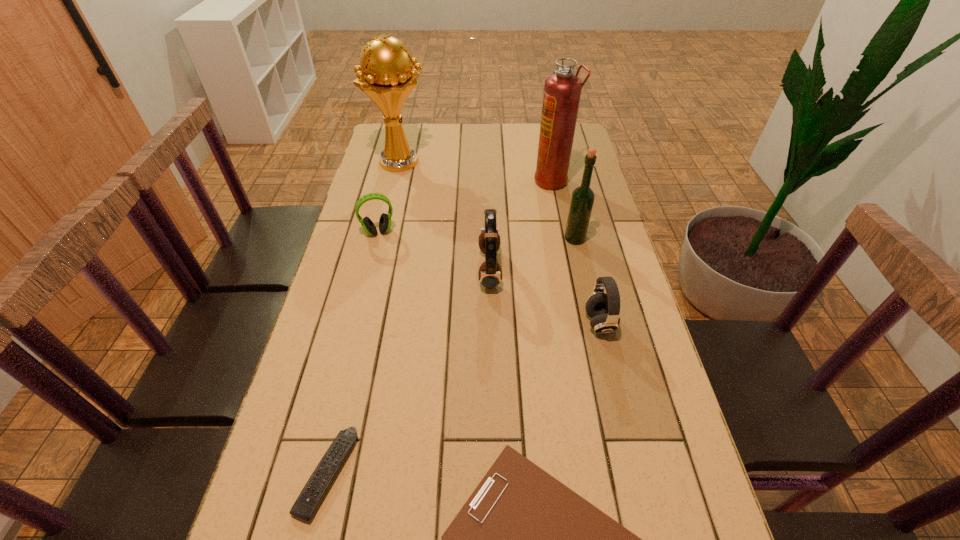
Where is `vacant space located 0.390m on the right of the leftmost headset`? vacant space located 0.390m on the right of the leftmost headset is located at coordinates (522, 232).

Identify the location of vacant position located 0.290m on the right of the remote control. This screenshot has height=540, width=960. (501, 473).

Find the location of a particular element. object that is at the far edge is located at coordinates (386, 75).

Find the location of a particular element. The image size is (960, 540). trophy_cup at the left edge is located at coordinates (386, 75).

You are a GUI agent. You are given a task and a screenshot of the screen. Output one action in this format:
    pyautogui.click(x=<x>, y=<y>)
    Task: Click on the headset that is at the left edge
    
    Given the screenshot: What is the action you would take?
    pyautogui.click(x=385, y=219)

I want to click on remote control present at the left edge, so click(305, 506).

Locate an element on the screen. The width and height of the screenshot is (960, 540). fire extinguisher situated at the right edge is located at coordinates click(562, 90).

Find the location of a particular element. This screenshot has height=540, width=960. liquor situated at the right edge is located at coordinates (582, 199).

Locate an element on the screen. headset that is at the right edge is located at coordinates (603, 309).

The image size is (960, 540). I want to click on object that is at the far left corner, so click(x=386, y=75).